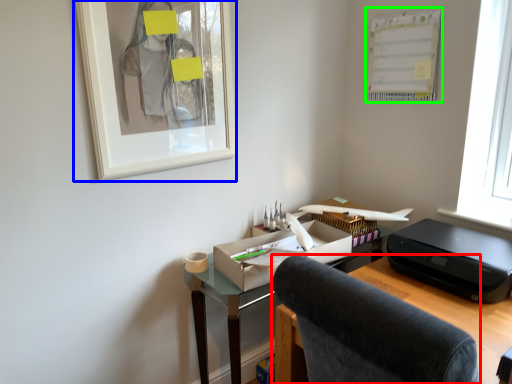
Question: Which is nearer to the chair (highlighted by a red box)? picture frame (highlighted by a blue box) or bulletin board (highlighted by a green box).

Choices:
 (A) picture frame
 (B) bulletin board

Answer: (A)